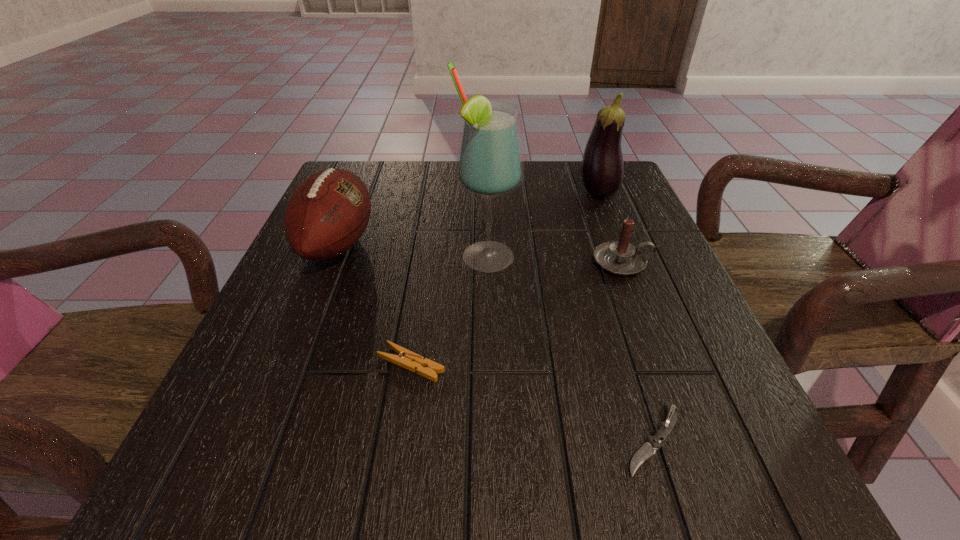
What are the coordinates of `the fourth object from right to left` in the screenshot? It's located at (489, 163).

The width and height of the screenshot is (960, 540). Find the location of `alcohol`. alcohol is located at coordinates (489, 163).

This screenshot has width=960, height=540. Find the location of `eggplant`. eggplant is located at coordinates (602, 170).

Where is `the farthest object`? The height and width of the screenshot is (540, 960). the farthest object is located at coordinates (602, 170).

Locate an element on the screen. This screenshot has width=960, height=540. the third tallest object is located at coordinates (327, 213).

Image resolution: width=960 pixels, height=540 pixels. In order to click on football (American) in this screenshot , I will do `click(327, 213)`.

Find the location of a particular element. the fourth tallest object is located at coordinates (620, 257).

Where is `the second object from left to right`? the second object from left to right is located at coordinates (407, 359).

In order to click on clothespin in this screenshot , I will do point(407,359).

Locate an element on the screen. This screenshot has width=960, height=540. the shortest object is located at coordinates (648, 449).